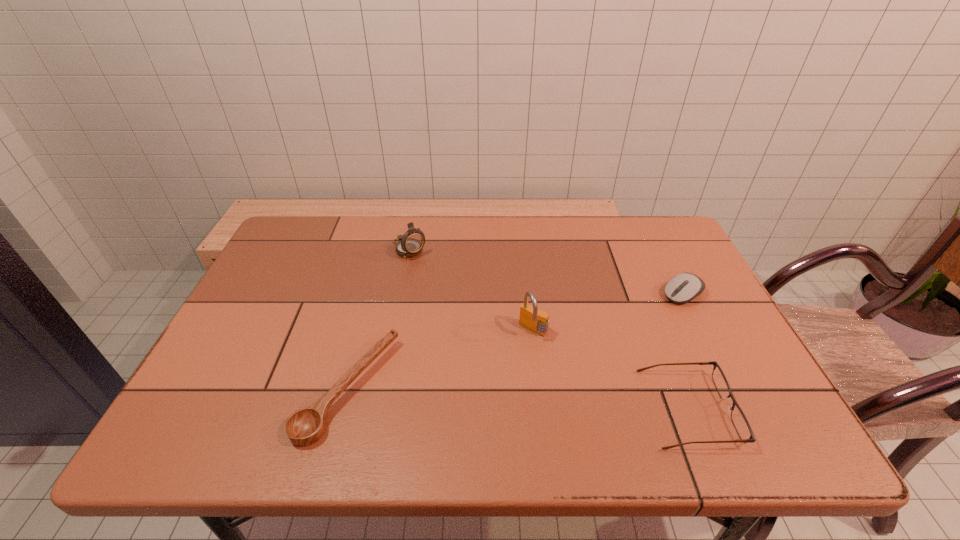
Where is `free space between the spectacles and the third object from right to left`? This screenshot has width=960, height=540. free space between the spectacles and the third object from right to left is located at coordinates (611, 370).

Locate an element on the screen. vacant space in between the spectacles and the padlock is located at coordinates (611, 370).

Find the location of `free space between the fourth nearest object and the compass`. free space between the fourth nearest object and the compass is located at coordinates (546, 272).

Identify the location of unoccupied position between the farthest object and the spectacles. (548, 329).

At what (x,y) coordinates should I click in order to perform the action: click on vacant space in between the spectacles and the third object from left to right. Please return your answer as a coordinate pair (x, y). Image resolution: width=960 pixels, height=540 pixels. Looking at the image, I should click on point(611,370).

Where is `vacant area that lies between the compass and the padlock`? The image size is (960, 540). vacant area that lies between the compass and the padlock is located at coordinates (471, 290).

This screenshot has height=540, width=960. Identify the location of free space that is in between the second farthest object and the spectacles. (685, 352).

Find the location of a particular element. free space between the padlock and the computer equipment is located at coordinates [608, 312].

Find the location of a particular element. This screenshot has height=540, width=960. object that is the third closest to the wooden spoon is located at coordinates (740, 422).

At what (x,y) coordinates should I click in order to perform the action: click on object that is the fourth closest one to the fourth nearest object. Please return your answer as a coordinate pair (x, y). Looking at the image, I should click on (304, 427).